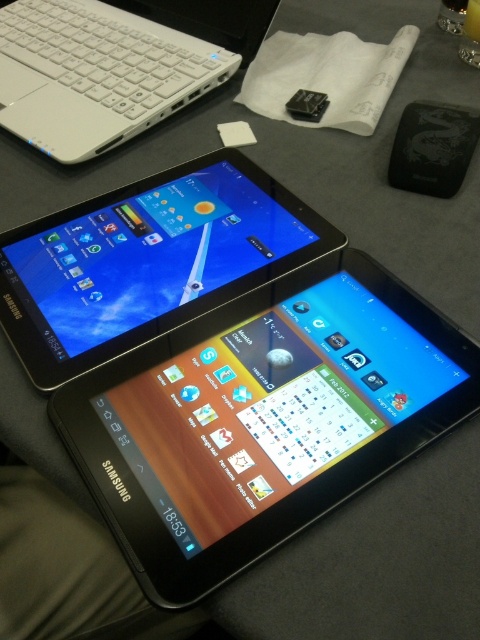
Question: Does black glossy tablet at upper center have a smaller size compared to white plastic laptop at upper left?

Choices:
 (A) yes
 (B) no

Answer: (A)

Question: Which is nearer to the black matte ipod at upper right?

Choices:
 (A) black glossy tablet at upper center
 (B) white plastic laptop at upper left

Answer: (A)

Question: Which of the following is the farthest from the observer?

Choices:
 (A) white plastic laptop at upper left
 (B) black glossy tablet at upper center

Answer: (A)

Question: Which of the following is the farthest from the observer?

Choices:
 (A) white plastic laptop at upper left
 (B) black matte ipod at upper right
 (C) black glossy tablet at upper center

Answer: (A)

Question: Considering the relative positions of black glossy tablet at upper center and white plastic laptop at upper left in the image provided, where is black glossy tablet at upper center located with respect to white plastic laptop at upper left?

Choices:
 (A) right
 (B) left

Answer: (A)

Question: Can you confirm if white plastic laptop at upper left is thinner than black matte ipod at upper right?

Choices:
 (A) yes
 (B) no

Answer: (B)